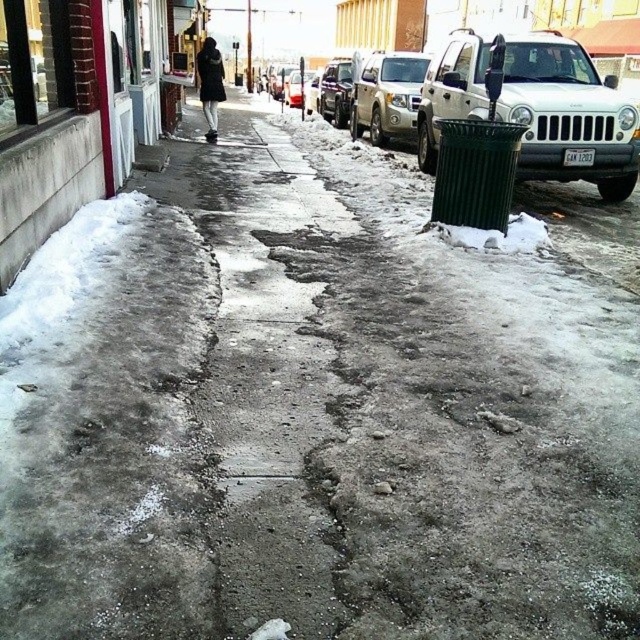
You are a delivery person trying to park your delivery van between the silver metallic jeep at right and the satin silver suv at center. According to the scene, can you park your van there without overlapping any vehicles?

The silver metallic jeep at right is positioned under the satin silver suv at center, meaning they are stacked vertically. Since they are not side by side, there is no space between them for your van to park without overlapping.

You are a delivery person trying to park your vehicle in this snowy area. You see a satin silver jeep at center and a metallic silver suv at center. Which vehicle is closer to the right side of the sidewalk?

The satin silver jeep at center is closer to the right side of the sidewalk because it is positioned to the right of the metallic silver suv at center.